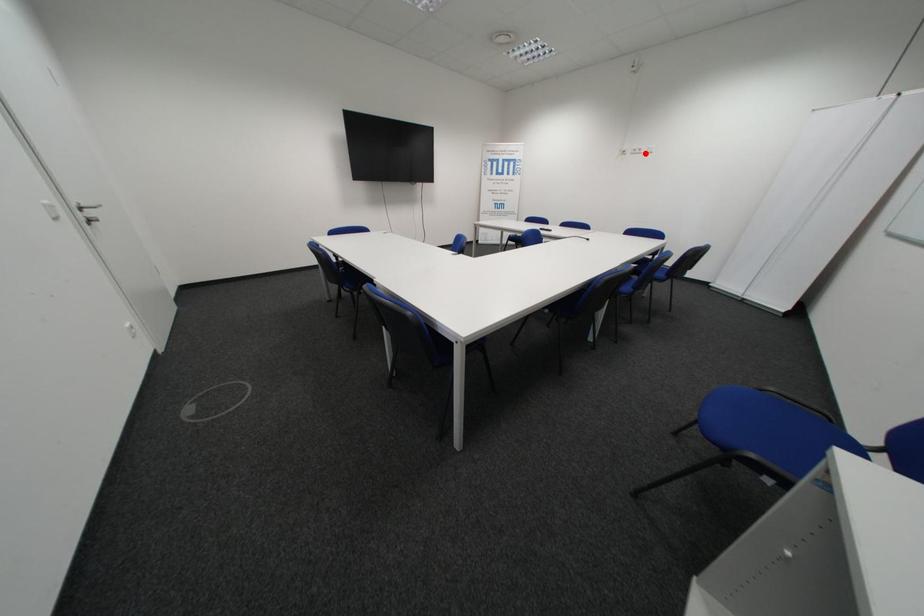
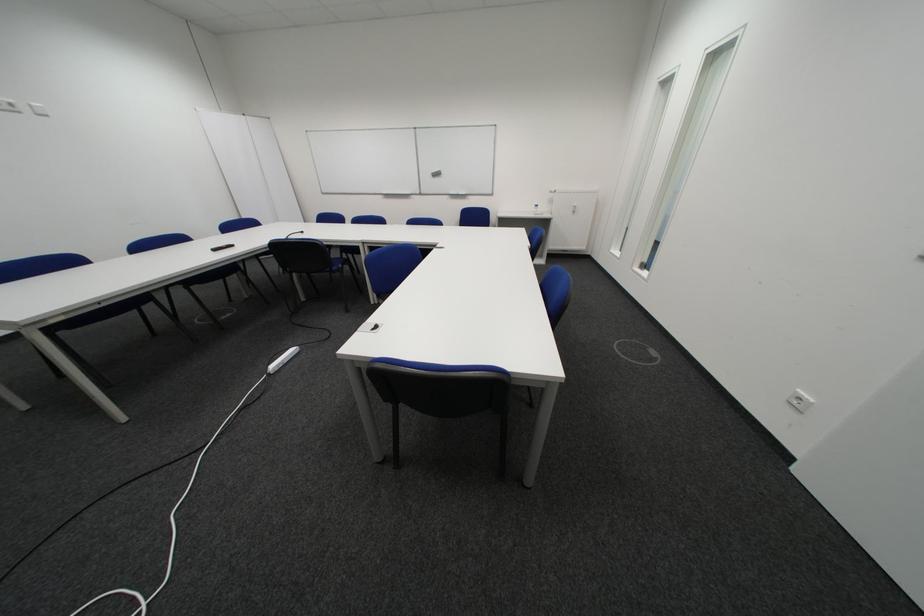
The point at the highlighted location is marked in the first image. Where is the corresponding point in the second image?

(8, 108)